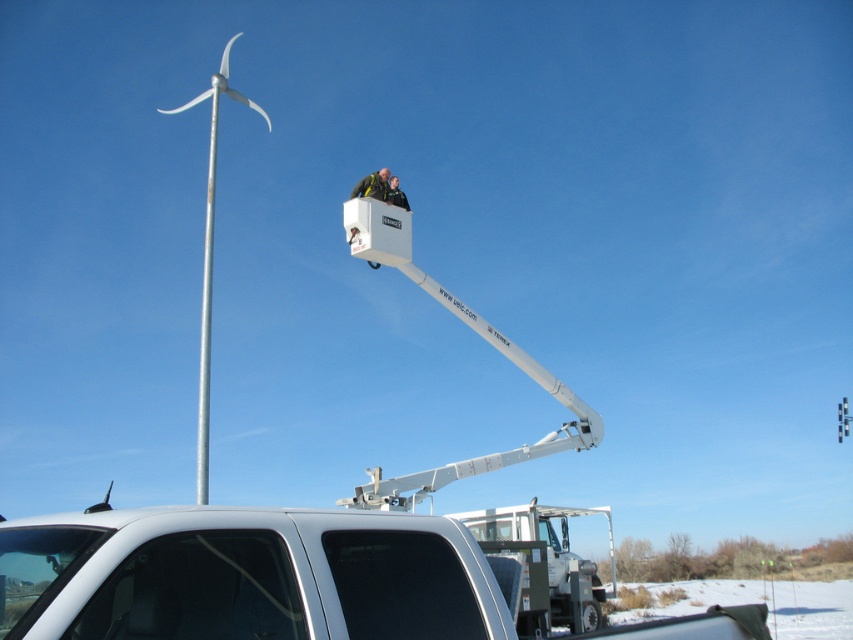
Question: Which point appears closest to the camera in this image?

Choices:
 (A) (389, 584)
 (B) (538, 512)
 (C) (206, 502)
 (D) (386, 168)

Answer: (A)

Question: Which of the following is the farthest from the observer?

Choices:
 (A) (152, 630)
 (B) (196, 476)
 (C) (381, 198)
 (D) (521, 636)

Answer: (B)

Question: Is silver metallic pole at upper center bigger than green fabric man at upper center?

Choices:
 (A) yes
 (B) no

Answer: (A)

Question: Is the position of white glossy pickup truck at lower left more distant than that of white plastic trailer truck at lower right?

Choices:
 (A) yes
 (B) no

Answer: (B)

Question: Which of the following is the farthest from the observer?

Choices:
 (A) white plastic trailer truck at lower right
 (B) silver metallic pole at upper center

Answer: (B)

Question: Does silver metallic pole at upper center have a smaller size compared to green fabric man at upper center?

Choices:
 (A) no
 (B) yes

Answer: (A)